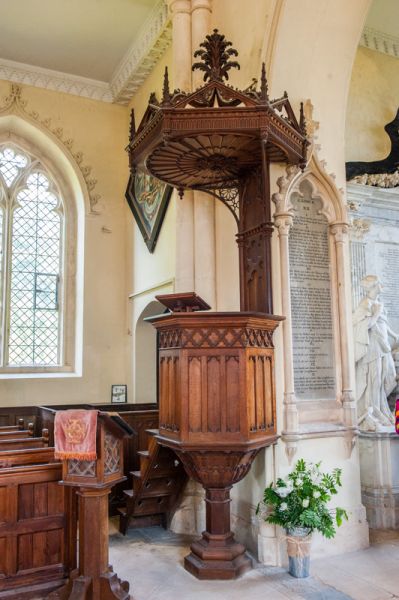
Locate an element on the screen. The image size is (399, 600). back of stair is located at coordinates (144, 521), (148, 506), (158, 483), (164, 467), (166, 452).